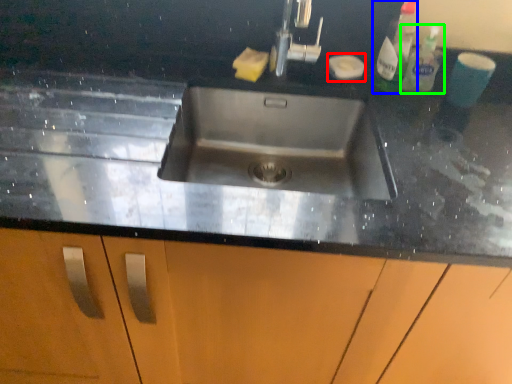
Question: Estimate the real-world distances between objects in this image. Which object is farther from soap (highlighted by a red box), cleaning product (highlighted by a blue box) or cleaning product (highlighted by a green box)?

Choices:
 (A) cleaning product
 (B) cleaning product

Answer: (B)